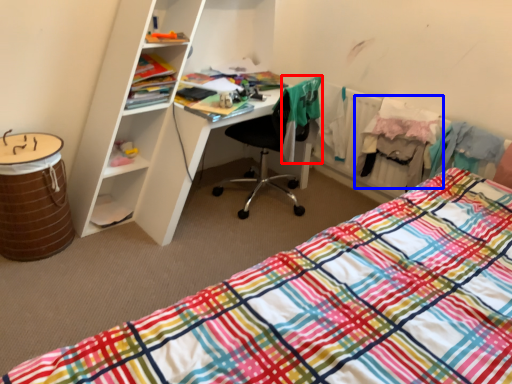
Question: Which of the following is the farthest to the observer, clothing (highlighted by a red box) or clothing (highlighted by a blue box)?

Choices:
 (A) clothing
 (B) clothing

Answer: (B)